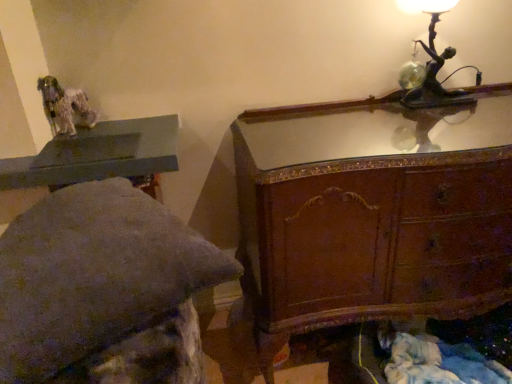
Question: Is the position of matte gray stone bench at upper left more distant than that of bronze metallic table lamp at upper right?

Choices:
 (A) yes
 (B) no

Answer: (B)

Question: Is matte gray stone bench at upper left not inside bronze metallic table lamp at upper right?

Choices:
 (A) no
 (B) yes

Answer: (B)

Question: From a real-world perspective, is matte gray stone bench at upper left located higher than bronze metallic table lamp at upper right?

Choices:
 (A) yes
 (B) no

Answer: (B)

Question: Considering the relative positions of matte gray stone bench at upper left and bronze metallic table lamp at upper right in the image provided, is matte gray stone bench at upper left to the left of bronze metallic table lamp at upper right from the viewer's perspective?

Choices:
 (A) no
 (B) yes

Answer: (B)

Question: Does matte gray stone bench at upper left have a lesser width compared to bronze metallic table lamp at upper right?

Choices:
 (A) yes
 (B) no

Answer: (B)

Question: Looking at their shapes, would you say wooden chest of drawers at upper right is wider or thinner than matte gray stone bench at upper left?

Choices:
 (A) thin
 (B) wide

Answer: (B)

Question: Relative to matte gray stone bench at upper left, is wooden chest of drawers at upper right in front or behind?

Choices:
 (A) front
 (B) behind

Answer: (B)

Question: Considering the positions of point (400, 258) and point (148, 208), is point (400, 258) closer or farther from the camera than point (148, 208)?

Choices:
 (A) farther
 (B) closer

Answer: (A)

Question: In terms of height, does wooden chest of drawers at upper right look taller or shorter compared to matte gray stone bench at upper left?

Choices:
 (A) short
 (B) tall

Answer: (B)

Question: Which is correct: wooden chest of drawers at upper right is inside bronze metallic table lamp at upper right, or outside of it?

Choices:
 (A) outside
 (B) inside

Answer: (A)

Question: Is wooden chest of drawers at upper right bigger or smaller than bronze metallic table lamp at upper right?

Choices:
 (A) small
 (B) big

Answer: (B)

Question: From the image's perspective, is wooden chest of drawers at upper right above or below bronze metallic table lamp at upper right?

Choices:
 (A) above
 (B) below

Answer: (B)

Question: Based on their positions, is wooden chest of drawers at upper right located to the left or right of bronze metallic table lamp at upper right?

Choices:
 (A) left
 (B) right

Answer: (A)

Question: Does point (77, 158) appear closer or farther from the camera than point (463, 89)?

Choices:
 (A) farther
 (B) closer

Answer: (B)

Question: Based on their sizes in the image, would you say matte gray table at upper left is bigger or smaller than bronze metallic table lamp at upper right?

Choices:
 (A) big
 (B) small

Answer: (A)